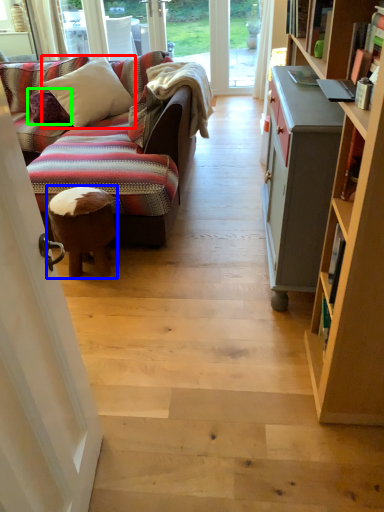
Question: Which object is positioned farthest from pillow (highlighted by a red box)? Select from stool (highlighted by a blue box) and pillow (highlighted by a green box).

Choices:
 (A) stool
 (B) pillow

Answer: (A)